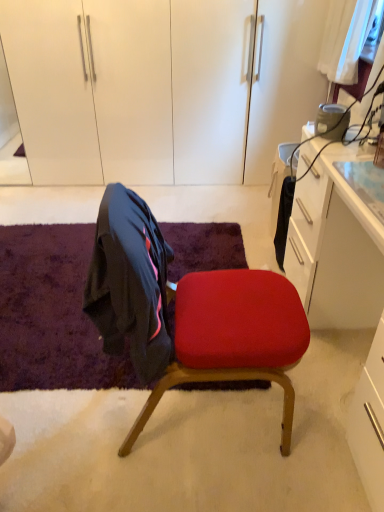
Identify the location of white glossy dresser at upper center. (161, 87).

I want to click on velvety purple mat at lower left, so click(51, 313).

What is the approximate height of velvety purple mat at lower left?

velvety purple mat at lower left is 2.30 inches tall.

The height and width of the screenshot is (512, 384). Find the location of `velvet red chair at center`. velvet red chair at center is located at coordinates (188, 312).

Considering the relative sizes of white glossy dresser at upper center and velvet red chair at center in the image provided, is white glossy dresser at upper center wider than velvet red chair at center?

Yes, white glossy dresser at upper center is wider than velvet red chair at center.

Do you think white glossy dresser at upper center is within velvet red chair at center, or outside of it?

white glossy dresser at upper center cannot be found inside velvet red chair at center.

Is white glossy dresser at upper center bigger than velvet red chair at center?

Correct, white glossy dresser at upper center is larger in size than velvet red chair at center.

Who is smaller, velvety purple mat at lower left or velvet red chair at center?

Smaller between the two is velvety purple mat at lower left.

Does point (175, 245) come closer to viewer compared to point (153, 362)?

No, it is not.

Where is `mat behind the velvet red chair at center`? This screenshot has width=384, height=512. mat behind the velvet red chair at center is located at coordinates (51, 313).

Considering the relative sizes of velvet red chair at center and velvety purple mat at lower left in the image provided, is velvet red chair at center wider than velvety purple mat at lower left?

No.

Would you say velvet red chair at center is outside velvety purple mat at lower left?

Absolutely, velvet red chair at center is external to velvety purple mat at lower left.

Does velvet red chair at center have a smaller size compared to velvety purple mat at lower left?

Actually, velvet red chair at center might be larger than velvety purple mat at lower left.

Does point (71, 249) come farther from viewer compared to point (21, 71)?

No, (71, 249) is closer to viewer.

Is white glossy dresser at upper center at the back of velvety purple mat at lower left?

No, velvety purple mat at lower left is not facing away from white glossy dresser at upper center.

How different are the orientations of velvety purple mat at lower left and white glossy dresser at upper center in degrees?

velvety purple mat at lower left and white glossy dresser at upper center are facing 0.15 degrees away from each other.

Locate an element on the screen. The image size is (384, 512). dresser above the velvety purple mat at lower left (from the image's perspective) is located at coordinates (161, 87).

Is velvet red chair at center oriented away from white glossy dresser at upper center?

No, velvet red chair at center is not facing the opposite direction of white glossy dresser at upper center.

Considering the points (225, 344) and (80, 34), which point is behind, point (225, 344) or point (80, 34)?

The point (80, 34) is behind.

Is velvet red chair at center bigger or smaller than white glossy dresser at upper center?

Clearly, velvet red chair at center is smaller in size than white glossy dresser at upper center.

From the picture: From a real-world perspective, is velvet red chair at center beneath white glossy dresser at upper center?

Yes.

From a real-world perspective, which object rests below the other?

velvety purple mat at lower left, from a real-world perspective.

From the picture: Is white glossy dresser at upper center at the right side of velvety purple mat at lower left?

Correct, you'll find white glossy dresser at upper center to the right of velvety purple mat at lower left.

Are white glossy dresser at upper center and velvety purple mat at lower left making contact?

They are not placed beside each other.

What are the coordinates of `chair that appears below the white glossy dresser at upper center (from the image's perspective)` in the screenshot? It's located at (188, 312).

Where is `chair that is on the right side of velvety purple mat at lower left`? The height and width of the screenshot is (512, 384). chair that is on the right side of velvety purple mat at lower left is located at coordinates (188, 312).

Based on their spatial positions, is white glossy dresser at upper center or velvety purple mat at lower left further from velvet red chair at center?

white glossy dresser at upper center.

Considering their positions, is velvet red chair at center positioned closer to velvety purple mat at lower left than white glossy dresser at upper center?

velvet red chair at center lies closer to velvety purple mat at lower left than the other object.

Looking at the image, which one is located closer to velvet red chair at center, velvety purple mat at lower left or white glossy dresser at upper center?

velvety purple mat at lower left.

Estimate the real-world distances between objects in this image. Which object is further from velvety purple mat at lower left, white glossy dresser at upper center or velvet red chair at center?

Based on the image, white glossy dresser at upper center appears to be further to velvety purple mat at lower left.

Looking at the image, which one is located further to white glossy dresser at upper center, velvet red chair at center or velvety purple mat at lower left?

velvet red chair at center lies further to white glossy dresser at upper center than the other object.

Considering their positions, is velvety purple mat at lower left positioned closer to white glossy dresser at upper center than velvet red chair at center?

velvety purple mat at lower left lies closer to white glossy dresser at upper center than the other object.

Locate an element on the screen. mat between white glossy dresser at upper center and velvet red chair at center in the up-down direction is located at coordinates (51, 313).